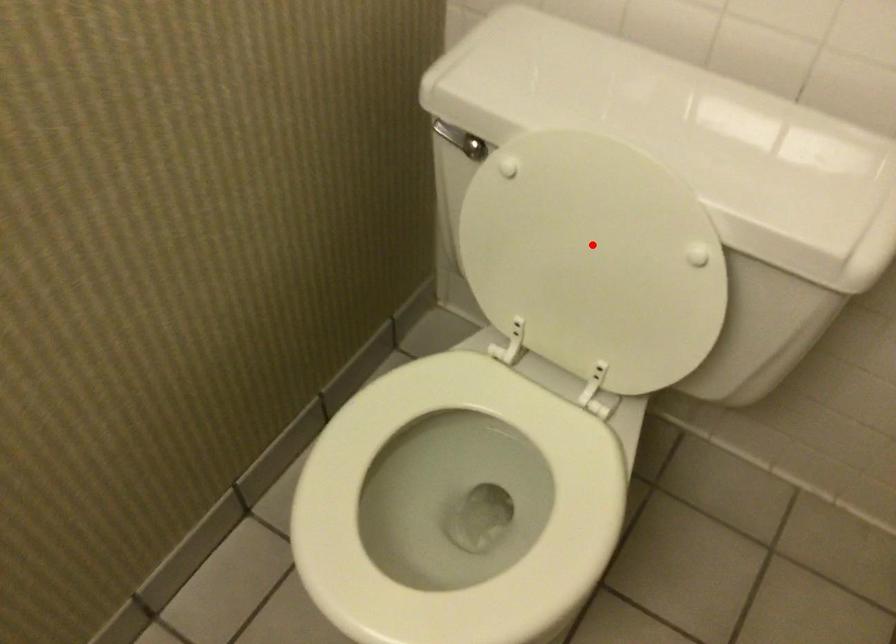
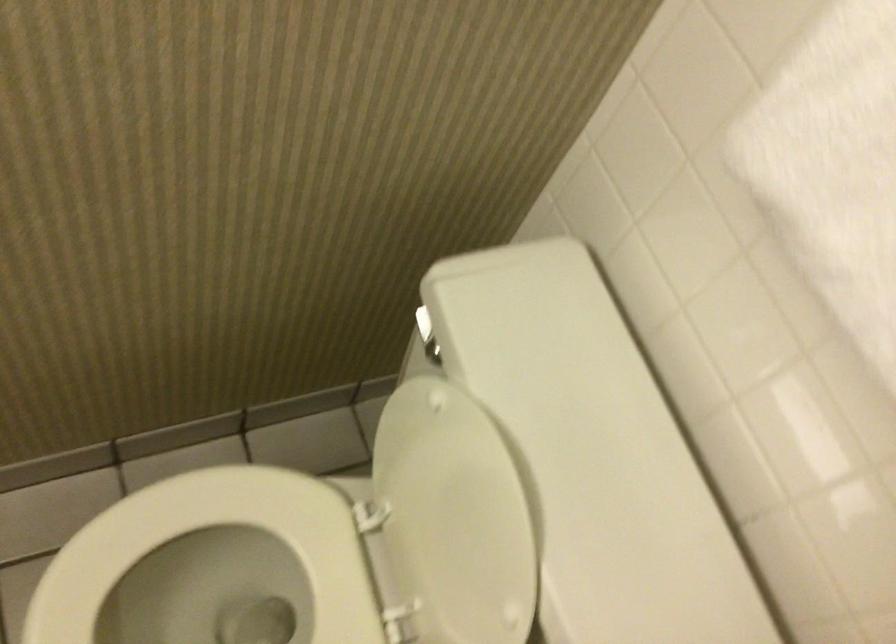
Where in the second image is the point corresponding to the highlighted location from the first image?

(453, 518)